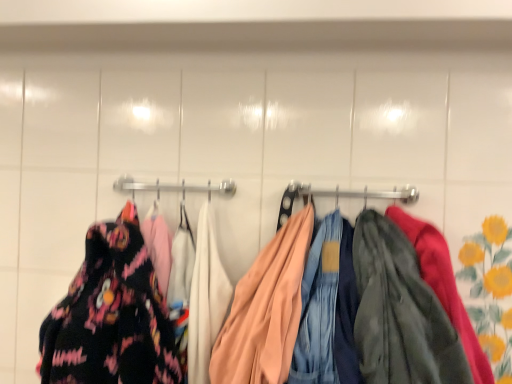
Where is `floral fabric dress at left`? floral fabric dress at left is located at coordinates (111, 316).

Describe the element at coordinates (111, 316) in the screenshot. I see `floral fabric dress at left` at that location.

This screenshot has width=512, height=384. What do you see at coordinates (443, 283) in the screenshot? I see `matte peach jacket at center` at bounding box center [443, 283].

What is the approximate height of matte peach jacket at center?

The height of matte peach jacket at center is 46.10 centimeters.

Image resolution: width=512 pixels, height=384 pixels. Find the location of `matte peach jacket at center`. matte peach jacket at center is located at coordinates (443, 283).

Where is `floral fabric dress at left`? This screenshot has height=384, width=512. floral fabric dress at left is located at coordinates (111, 316).

Which object is positioned more to the right, floral fabric dress at left or matte peach jacket at center?

matte peach jacket at center is more to the right.

Which object is further away from the camera, floral fabric dress at left or matte peach jacket at center?

floral fabric dress at left.

Considering the points (131, 298) and (342, 195), which point is in front, point (131, 298) or point (342, 195)?

Point (131, 298)

From the image's perspective, between floral fabric dress at left and matte peach jacket at center, which one is located above?

floral fabric dress at left, from the image's perspective.

From a real-world perspective, is floral fabric dress at left located beneath matte peach jacket at center?

Correct, in the physical world, floral fabric dress at left is lower than matte peach jacket at center.

Which of these two, floral fabric dress at left or matte peach jacket at center, is wider?

matte peach jacket at center.

From their relative heights in the image, would you say floral fabric dress at left is taller or shorter than matte peach jacket at center?

Clearly, floral fabric dress at left is taller compared to matte peach jacket at center.

Can you confirm if floral fabric dress at left is bigger than matte peach jacket at center?

Actually, floral fabric dress at left might be smaller than matte peach jacket at center.

Is floral fabric dress at left situated inside matte peach jacket at center or outside?

floral fabric dress at left is not inside matte peach jacket at center, it's outside.

Would you say floral fabric dress at left is a long distance from matte peach jacket at center?

No, floral fabric dress at left is in close proximity to matte peach jacket at center.

Based on the photo, is floral fabric dress at left looking in the opposite direction of matte peach jacket at center?

No, floral fabric dress at left is not facing away from matte peach jacket at center.

Where is `laundry on the right of floral fabric dress at left`? The image size is (512, 384). laundry on the right of floral fabric dress at left is located at coordinates (443, 283).

Does matte peach jacket at center appear on the right side of floral fabric dress at left?

Correct, you'll find matte peach jacket at center to the right of floral fabric dress at left.

Considering the relative positions of matte peach jacket at center and floral fabric dress at left in the image provided, is matte peach jacket at center behind floral fabric dress at left?

No, the depth of matte peach jacket at center is less than that of floral fabric dress at left.

Based on the photo, which is nearer, (447, 279) or (116, 312)?

Point (447, 279) is positioned closer to the camera compared to point (116, 312).

From the image's perspective, who appears lower, matte peach jacket at center or floral fabric dress at left?

From the image's view, matte peach jacket at center is below.

From a real-world perspective, is matte peach jacket at center located beneath floral fabric dress at left?

No, from a real-world perspective, matte peach jacket at center is not under floral fabric dress at left.

Based on the photo, can you confirm if matte peach jacket at center is thinner than floral fabric dress at left?

No, matte peach jacket at center is not thinner than floral fabric dress at left.

Does matte peach jacket at center have a greater height compared to floral fabric dress at left?

No.

Looking at the image, does matte peach jacket at center seem bigger or smaller compared to floral fabric dress at left?

matte peach jacket at center is bigger than floral fabric dress at left.

Do you think matte peach jacket at center is within floral fabric dress at left, or outside of it?

matte peach jacket at center lies outside floral fabric dress at left.

Is matte peach jacket at center placed right next to floral fabric dress at left?

matte peach jacket at center is not next to floral fabric dress at left, and they're not touching.

Is matte peach jacket at center positioned with its back to floral fabric dress at left?

No, matte peach jacket at center's orientation is not away from floral fabric dress at left.

Can you tell me how much matte peach jacket at center and floral fabric dress at left differ in facing direction?

The facing directions of matte peach jacket at center and floral fabric dress at left are 0.000759 degrees apart.

What are the coordinates of `laundry that appears in front of the floral fabric dress at left` in the screenshot? It's located at (443, 283).

Identify the location of fancy dress below the matte peach jacket at center (from a real-world perspective). Image resolution: width=512 pixels, height=384 pixels. (111, 316).

In the image, there is a floral fabric dress at left. At what (x,y) coordinates should I click in order to perform the action: click on laundry below it (from the image's perspective). Please return your answer as a coordinate pair (x, y). The width and height of the screenshot is (512, 384). Looking at the image, I should click on click(443, 283).